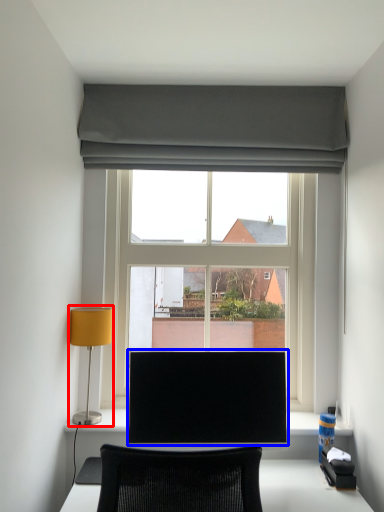
Question: Which object appears farthest to the camera in this image, table lamp (highlighted by a red box) or computer monitor (highlighted by a blue box)?

Choices:
 (A) table lamp
 (B) computer monitor

Answer: (A)